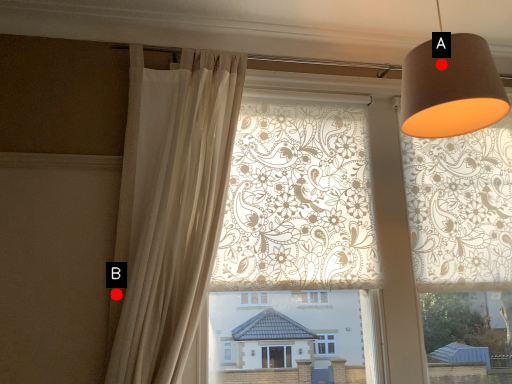
Question: Two points are circled on the image, labeled by A and B beside each circle. Among these points, which one is farthest from the camera?

Choices:
 (A) A is further
 (B) B is further

Answer: (B)